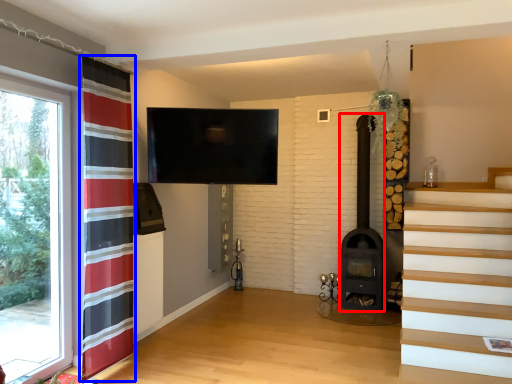
Question: Which of the following is the farthest to the observer, fireplace (highlighted by a red box) or curtain (highlighted by a blue box)?

Choices:
 (A) fireplace
 (B) curtain

Answer: (A)